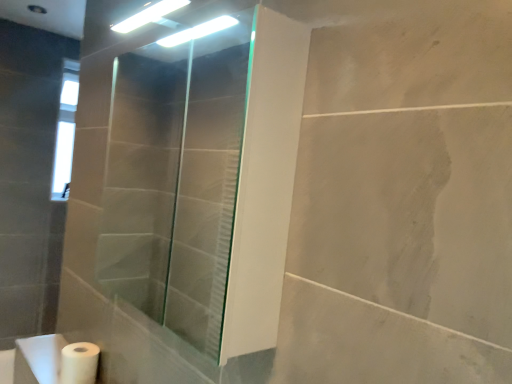
The image size is (512, 384). In order to click on white matte toilet paper at lower left in this screenshot , I will do `click(79, 363)`.

In order to face white matte sink at lower left, should I rotate leftwards or rightwards?

You should rotate left by 24.812 degrees.

Find the location of a particular element. The height and width of the screenshot is (384, 512). white matte toilet paper at lower left is located at coordinates (79, 363).

Is transparent glass shower door at center taller than white matte sink at lower left?

Indeed, transparent glass shower door at center has a greater height compared to white matte sink at lower left.

Considering the sizes of transparent glass shower door at center and white matte sink at lower left in the image, is transparent glass shower door at center wider or thinner than white matte sink at lower left?

transparent glass shower door at center is wider than white matte sink at lower left.

Which is closer to the camera, (189, 55) or (60, 358)?

Point (189, 55).

From the picture: Between transparent glass shower door at center and white matte sink at lower left, which one appears on the right side from the viewer's perspective?

From the viewer's perspective, transparent glass shower door at center appears more on the right side.

Is white matte sink at lower left not close to transparent glass shower door at center?

That's right, there is a large distance between white matte sink at lower left and transparent glass shower door at center.

Considering the relative positions of white matte sink at lower left and transparent glass shower door at center in the image provided, is white matte sink at lower left to the left or to the right of transparent glass shower door at center?

Clearly, white matte sink at lower left is on the left of transparent glass shower door at center in the image.

This screenshot has height=384, width=512. What are the coordinates of `sink that appears on the left of transparent glass shower door at center` in the screenshot? It's located at (54, 360).

Which object is further away from the camera taking this photo, white matte toilet paper at lower left or white matte sink at lower left?

white matte toilet paper at lower left is behind.

From the image's perspective, is white matte toilet paper at lower left located beneath white matte sink at lower left?

Actually, white matte toilet paper at lower left appears above white matte sink at lower left in the image.

Is white matte toilet paper at lower left oriented away from white matte sink at lower left?

No.

Looking at this image, would you say transparent glass shower door at center contains white matte toilet paper at lower left?

Definitely not — white matte toilet paper at lower left is not inside transparent glass shower door at center.

From a real-world perspective, is transparent glass shower door at center above or below white matte toilet paper at lower left?

Clearly, from a real-world perspective, transparent glass shower door at center is above white matte toilet paper at lower left.

Is transparent glass shower door at center to the left of white matte toilet paper at lower left from the viewer's perspective?

No.

Would you say white matte toilet paper at lower left is a long distance from transparent glass shower door at center?

That's right, there is a large distance between white matte toilet paper at lower left and transparent glass shower door at center.

The height and width of the screenshot is (384, 512). Identify the location of shower door in front of the white matte toilet paper at lower left. (176, 178).

From the picture: Which of these two, white matte toilet paper at lower left or transparent glass shower door at center, stands taller?

With more height is transparent glass shower door at center.

Considering the sizes of white matte toilet paper at lower left and transparent glass shower door at center in the image, is white matte toilet paper at lower left bigger or smaller than transparent glass shower door at center?

Considering their sizes, white matte toilet paper at lower left takes up less space than transparent glass shower door at center.

Is white matte sink at lower left further to the viewer compared to white matte toilet paper at lower left?

No, the depth of white matte sink at lower left is less than that of white matte toilet paper at lower left.

Is white matte sink at lower left facing towards white matte toilet paper at lower left?

No, white matte sink at lower left is not facing towards white matte toilet paper at lower left.

Could white matte toilet paper at lower left be considered to be inside white matte sink at lower left?

No.

From a real-world perspective, between white matte sink at lower left and white matte toilet paper at lower left, who is vertically higher?

white matte toilet paper at lower left.

Locate an element on the screen. The height and width of the screenshot is (384, 512). shower door lying in front of the white matte sink at lower left is located at coordinates (176, 178).

Find the location of a particular element. The height and width of the screenshot is (384, 512). sink beneath the transparent glass shower door at center (from a real-world perspective) is located at coordinates (54, 360).

Looking at the image, which one is located closer to white matte sink at lower left, transparent glass shower door at center or white matte toilet paper at lower left?

Among the two, white matte toilet paper at lower left is located nearer to white matte sink at lower left.

From the image, which object appears to be farther from transparent glass shower door at center, white matte toilet paper at lower left or white matte sink at lower left?

The object further to transparent glass shower door at center is white matte toilet paper at lower left.

Looking at the image, which one is located further to white matte toilet paper at lower left, white matte sink at lower left or transparent glass shower door at center?

transparent glass shower door at center is positioned further to the anchor white matte toilet paper at lower left.

Considering their positions, is transparent glass shower door at center positioned closer to white matte toilet paper at lower left than white matte sink at lower left?

The object closer to white matte toilet paper at lower left is white matte sink at lower left.

Which object lies nearer to the anchor point white matte sink at lower left, white matte toilet paper at lower left or transparent glass shower door at center?

Based on the image, white matte toilet paper at lower left appears to be nearer to white matte sink at lower left.

Based on their spatial positions, is white matte sink at lower left or white matte toilet paper at lower left closer to transparent glass shower door at center?

white matte sink at lower left is positioned closer to the anchor transparent glass shower door at center.

Image resolution: width=512 pixels, height=384 pixels. I want to click on sink between transparent glass shower door at center and white matte toilet paper at lower left in the front-back direction, so click(54, 360).